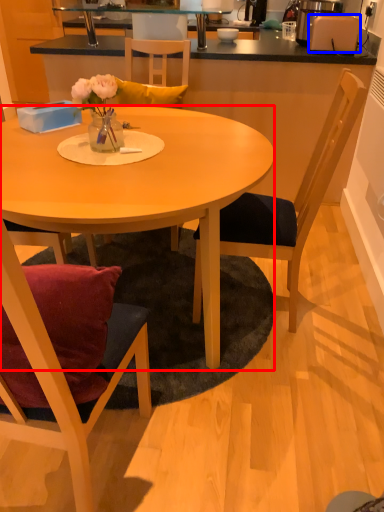
Question: Which object appears farthest to the camera in this image, desk (highlighted by a red box) or toaster (highlighted by a blue box)?

Choices:
 (A) desk
 (B) toaster

Answer: (B)